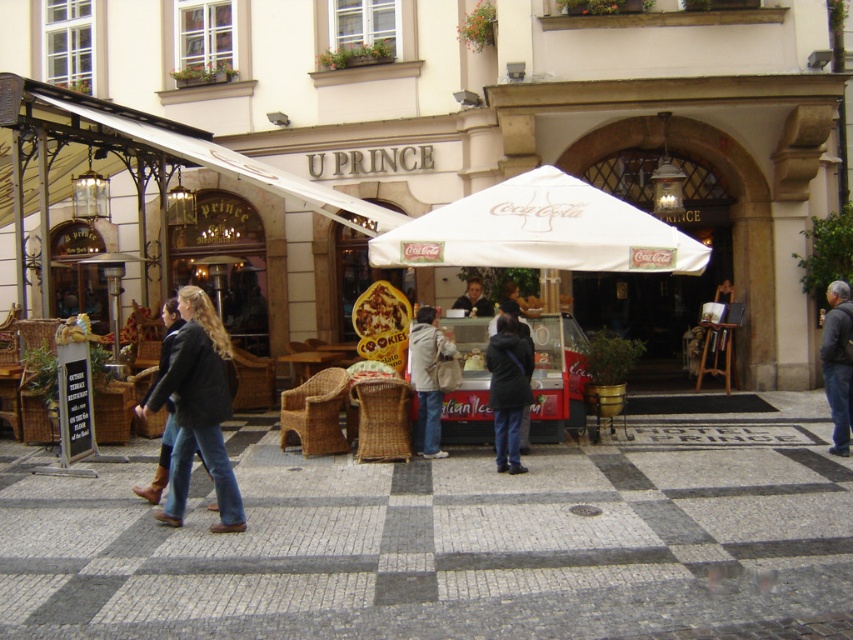
Can you confirm if dark blue jeans at center is smaller than dark brown leather jacket at center?

No, dark blue jeans at center is not smaller than dark brown leather jacket at center.

Is dark blue jeans at center to the right of dark brown leather jacket at center from the viewer's perspective?

In fact, dark blue jeans at center is to the left of dark brown leather jacket at center.

Image resolution: width=853 pixels, height=640 pixels. In order to click on dark blue jeans at center in this screenshot , I will do `click(508, 390)`.

Find the location of `gray stone square at center`. gray stone square at center is located at coordinates (537, 528).

Which of these two, gray stone square at center or light beige jacket at center, stands shorter?

gray stone square at center is shorter.

Find the location of `gray stone square at center`. gray stone square at center is located at coordinates pyautogui.click(x=537, y=528).

Is checkerboard stone pavement at center below dark brown leather jacket at center?

Correct, checkerboard stone pavement at center is located below dark brown leather jacket at center.

Measure the distance between checkerboard stone pavement at center and camera.

They are 8.03 meters apart.

Between point (721, 628) and point (515, 307), which one is positioned in front?

Point (721, 628) is more forward.

Where is `checkerboard stone pavement at center`? This screenshot has height=640, width=853. checkerboard stone pavement at center is located at coordinates (453, 540).